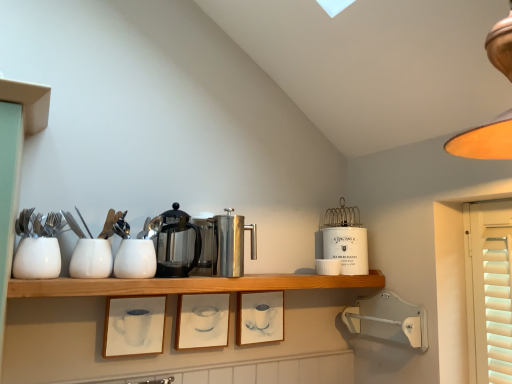
Question: Is matte orange lampshade at upper right spatially inside polished stainless steel coffee press at center, marked as the second appliance in a left-to-right arrangement, or outside of it?

Choices:
 (A) inside
 (B) outside

Answer: (B)

Question: From the image's perspective, is matte orange lampshade at upper right located above or below polished stainless steel coffee press at center, the third appliance viewed from the back?

Choices:
 (A) above
 (B) below

Answer: (A)

Question: Considering the real-world distances, which object is farthest from the white ceramic cup at upper right, placed as the 1th tableware when sorted from right to left?

Choices:
 (A) white ceramic canister at upper center, marked as the first appliance in a back-to-front arrangement
 (B) white matte cup at left, which is counted as the 4th tableware, starting from the back
 (C) white glossy cup at center, which is counted as the second tableware, starting from the front
 (D) satin silver carafe at center, marked as the 2th appliance in a front-to-back arrangement
 (E) matte white picture frame at center, positioned as the 1th picture frame in right-to-left order

Answer: (B)

Question: Which object is positioned farthest from the polished stainless steel coffee pot at center?

Choices:
 (A) white ceramic cup at upper right, which is the first tableware from back to front
 (B) matte white picture frame at center, which is counted as the 2th picture frame, starting from the left
 (C) polished stainless steel coffee press at center, acting as the second appliance starting from the right
 (D) white matte cup at left, which is counted as the 4th tableware, starting from the back
 (E) white ceramic canister at upper center, placed as the first appliance when sorted from right to left

Answer: (E)